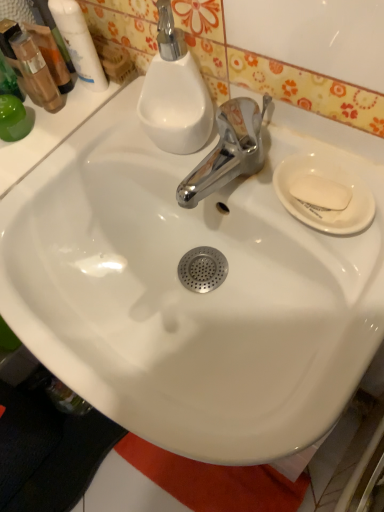
Locate an element on the screen. The width and height of the screenshot is (384, 512). free location in front of white matte soap at right is located at coordinates (340, 287).